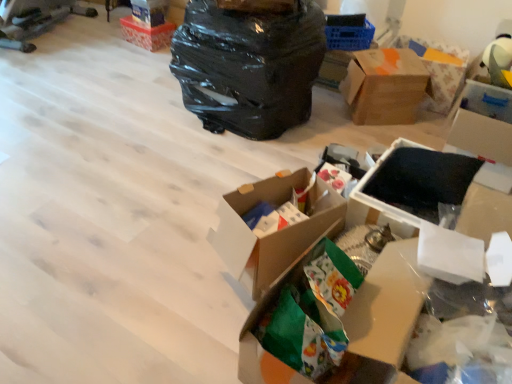
I want to click on vacant space situated on the left part of orange cardboard box at upper left, the 5th box from the right, so click(109, 41).